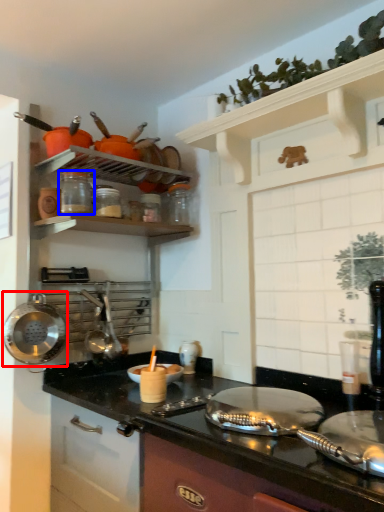
Question: Which of the following is the closest to the observer, wok (highlighted by a red box) or appliance (highlighted by a blue box)?

Choices:
 (A) wok
 (B) appliance

Answer: (A)